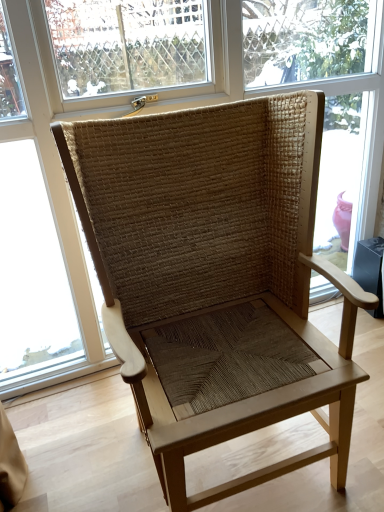
Describe the element at coordinates (216, 278) in the screenshot. I see `natural woven chair at center` at that location.

Where is `natural woven chair at center`? This screenshot has height=512, width=384. natural woven chair at center is located at coordinates (216, 278).

Image resolution: width=384 pixels, height=512 pixels. Find the location of `natural woven chair at center`. natural woven chair at center is located at coordinates (216, 278).